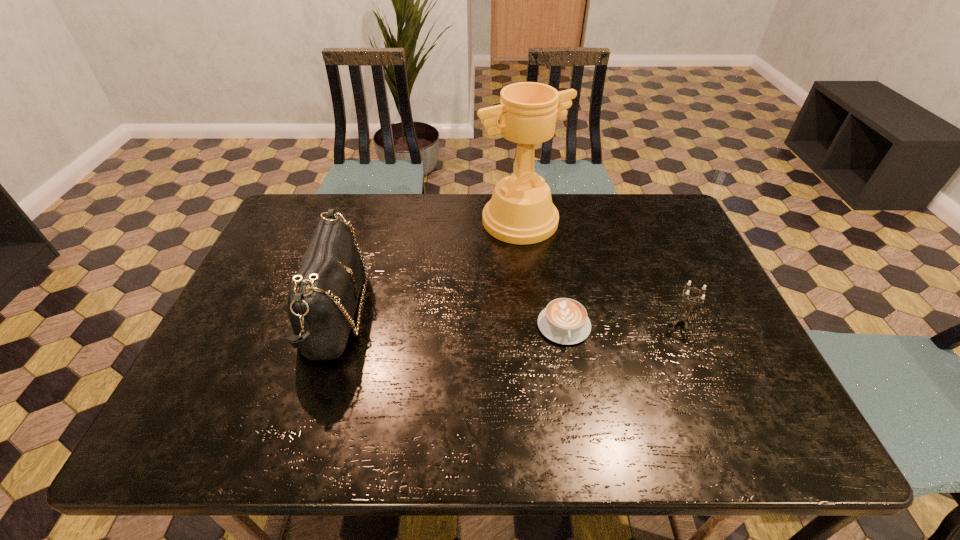
The image size is (960, 540). Find the location of `the farthest object`. the farthest object is located at coordinates (521, 211).

Find the location of `the tallest object`. the tallest object is located at coordinates (521, 211).

This screenshot has height=540, width=960. Find the location of `the third shortest object`. the third shortest object is located at coordinates (322, 300).

Image resolution: width=960 pixels, height=540 pixels. I want to click on the leftmost object, so (322, 300).

Locate an element on the screen. The height and width of the screenshot is (540, 960). the third tallest object is located at coordinates (682, 317).

Where is `the rightmost object`? This screenshot has width=960, height=540. the rightmost object is located at coordinates (682, 317).

Locate an element on the screen. cappuccino is located at coordinates (564, 321).

The image size is (960, 540). In order to click on vacant region located on the front of the tallest object in this screenshot , I will do tap(529, 305).

The image size is (960, 540). In order to click on free space located 0.230m at the front of the third shortest object with chain and zipper in this screenshot , I will do `click(458, 314)`.

In order to click on vacant space located 0.060m on the right of the third tallest object in this screenshot , I will do `click(717, 322)`.